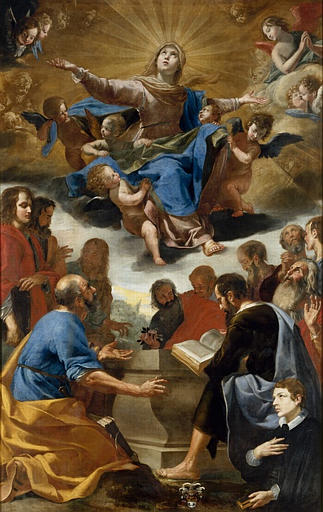
Find the location of a particular element. The height and width of the screenshot is (512, 323). open book is located at coordinates (197, 352).